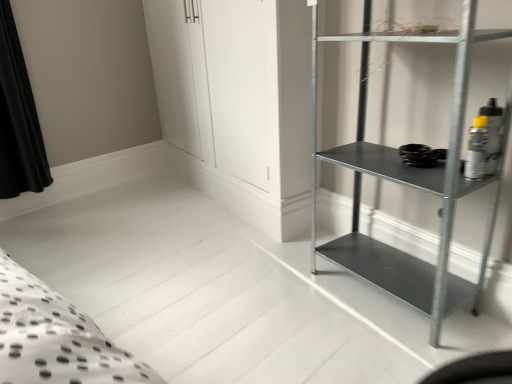
Question: In the image, is metallic gray shelf at right on the left side or the right side of metallic gray shelf at right?

Choices:
 (A) right
 (B) left

Answer: (B)

Question: Looking at their shapes, would you say metallic gray shelf at right is wider or thinner than metallic gray shelf at right?

Choices:
 (A) thin
 (B) wide

Answer: (B)

Question: From the image's perspective, relative to metallic gray shelf at right, is metallic gray shelf at right above or below?

Choices:
 (A) below
 (B) above

Answer: (B)

Question: Relative to metallic gray shelf at right, is metallic gray shelf at right in front or behind?

Choices:
 (A) behind
 (B) front

Answer: (A)

Question: Is metallic gray shelf at right taller or shorter than metallic gray shelf at right?

Choices:
 (A) tall
 (B) short

Answer: (B)

Question: From the image's perspective, is metallic gray shelf at right above or below metallic gray shelf at right?

Choices:
 (A) below
 (B) above

Answer: (A)

Question: Looking at the image, does metallic gray shelf at right seem bigger or smaller compared to metallic gray shelf at right?

Choices:
 (A) small
 (B) big

Answer: (A)